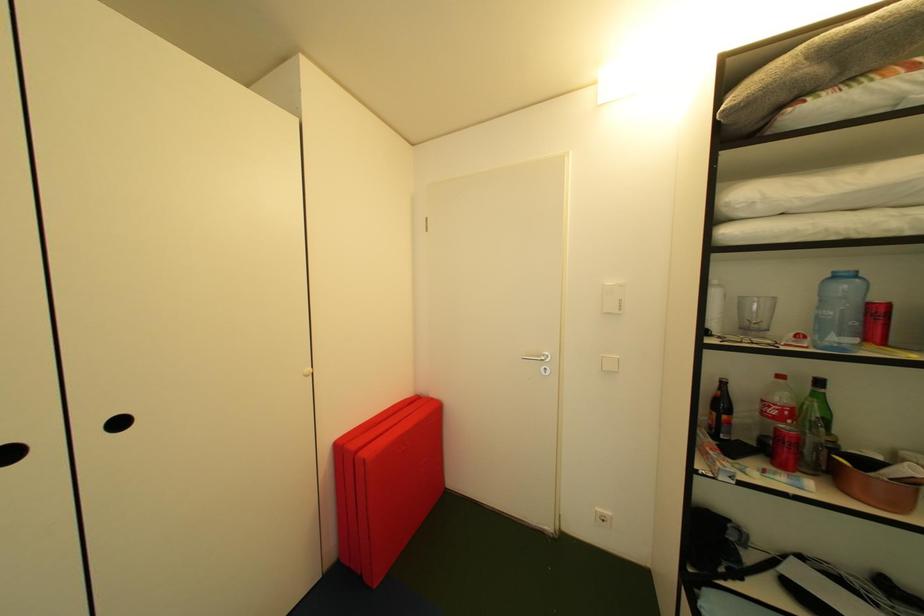
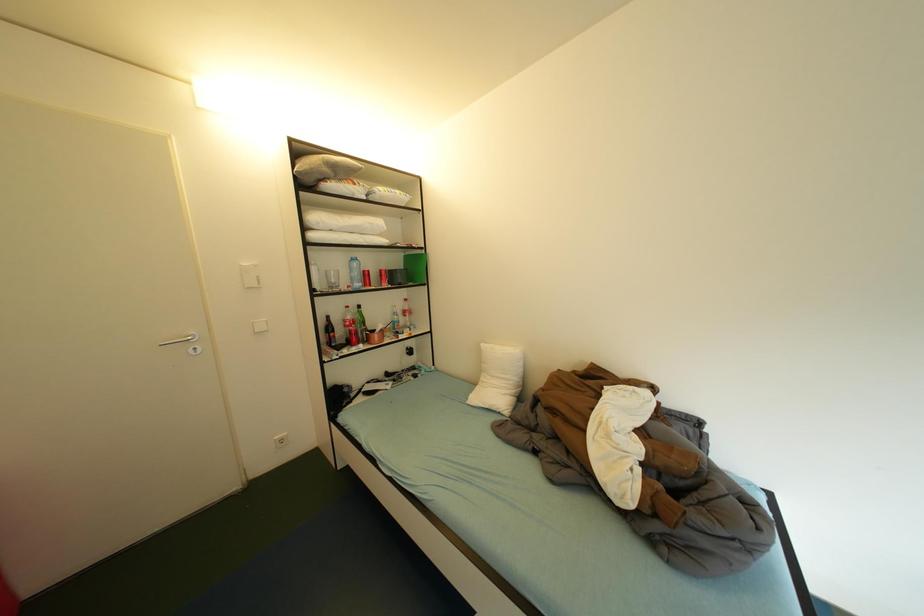
Question: Based on the continuous images, in which direction is the camera rotating? Reply with the corresponding letter.

Choices:
 (A) Left
 (B) Right
 (C) Up
 (D) Down

Answer: (B)